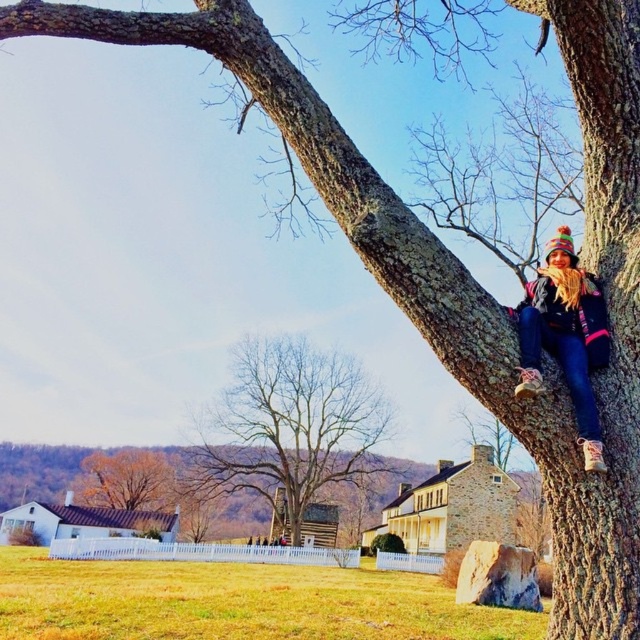
You are standing at the center of the image and want to walk towards the point marked at coordinates (611,321). Which direction should you go to reach the smooth bark tree trunk at right?

The point at coordinates (611,321) marks the smooth bark tree trunk at right, so you should walk towards the right to reach it.

You are an artist trying to sketch this scene. You notice the multicolored knitted hat at upper right and the golden brown leaves at lower left. Which object should you draw first to maintain the correct spatial relationship between them?

You should draw the multicolored knitted hat at upper right first because it is in front of the golden brown leaves at lower left, so it should be placed over the leaves in the sketch.

You are standing at the origin point in the coordinate system of the image. You want to walk towards the brown rough tree at center. Which direction should you head?

The brown rough tree at center is located at coordinates point (289, 428). Since you are at the origin, you should move towards the right and slightly upward to reach it.